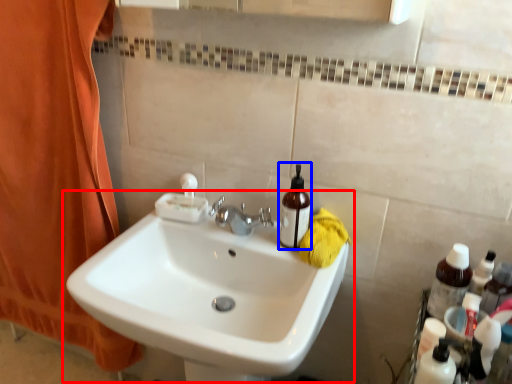
Question: Which of the following is the closest to the observer, sink (highlighted by a red box) or mouthwash (highlighted by a blue box)?

Choices:
 (A) sink
 (B) mouthwash

Answer: (A)